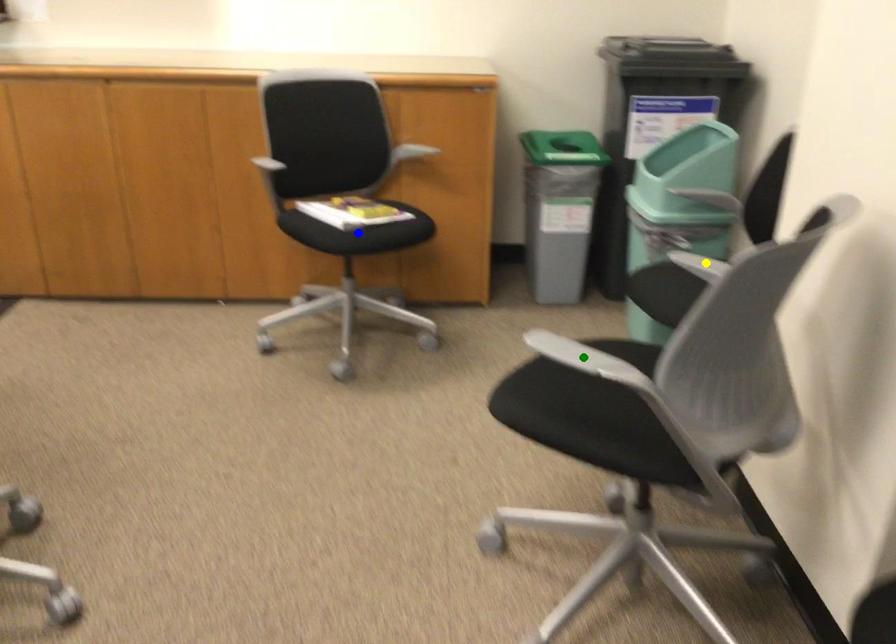
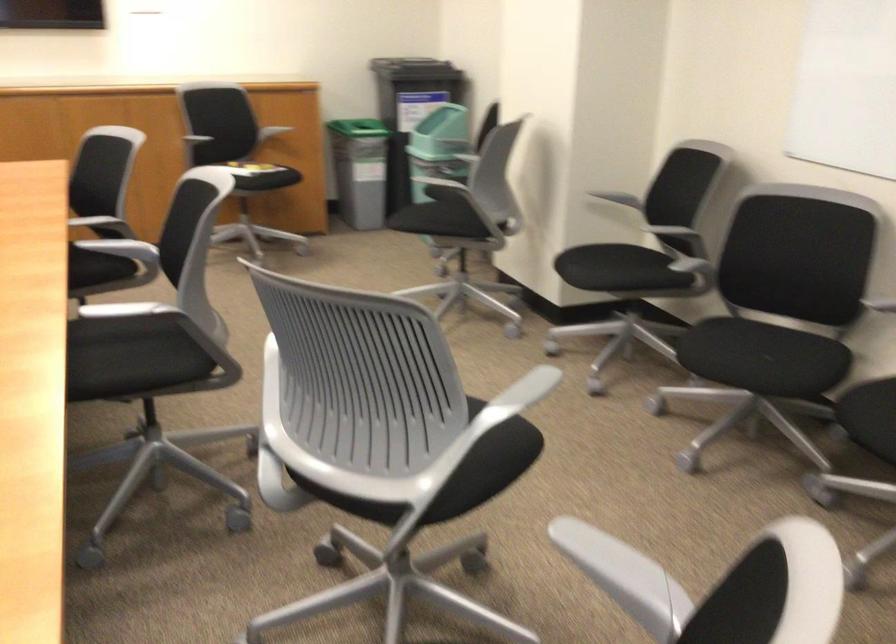
I am providing you with two images of the same scene from different viewpoints. Three points are marked in image1. Which point corresponds to a part or object that is occluded in image2?In image1, three points are marked. Which of them correspond to a part or object that is occluded in image2?Among the three points shown in image1, which one corresponds to a part or object that is no longer visible due to occlusion in image2?

green point, yellow point, blue point